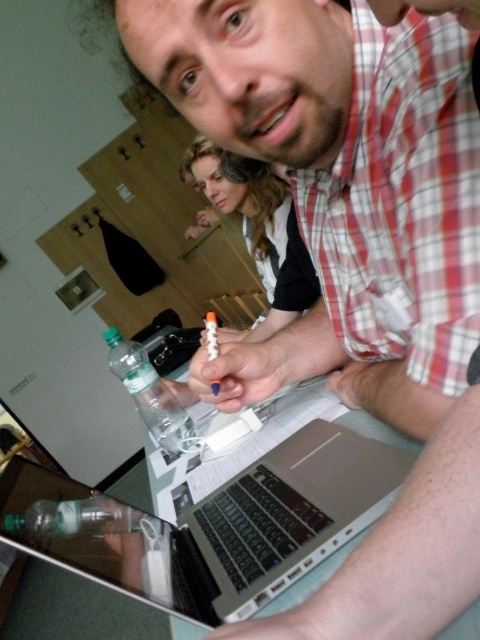
Question: Is blonde hair at center closer to the viewer compared to clear plastic bottle at center?

Choices:
 (A) yes
 (B) no

Answer: (A)

Question: Does blonde hair at center appear under clear plastic bottle at lower left?

Choices:
 (A) no
 (B) yes

Answer: (A)

Question: Which of the following is the closest to the observer?

Choices:
 (A) clear plastic bottle at lower left
 (B) blonde hair at center

Answer: (A)

Question: Among these points, which one is nearest to the camera?

Choices:
 (A) (136, 381)
 (B) (284, 260)
 (C) (316, 428)
 (D) (211, 321)

Answer: (C)

Question: Which object is the farthest from the clear plastic bottle at center?

Choices:
 (A) translucent plastic pen at center
 (B) clear plastic bottle at lower left
 (C) silver metallic laptop at center
 (D) blonde hair at center

Answer: (D)

Question: Does clear plastic bottle at center have a smaller size compared to clear plastic bottle at lower left?

Choices:
 (A) no
 (B) yes

Answer: (A)